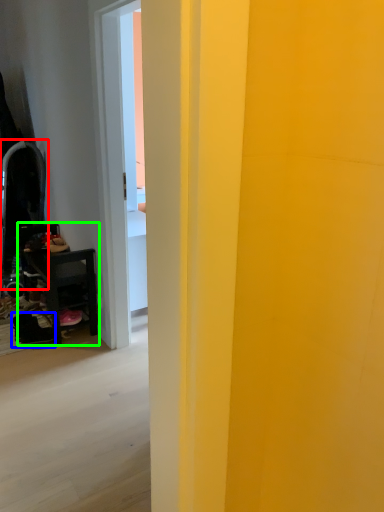
Question: Which object is positioned farthest from swivel chair (highlighted by a red box)? Select from footwear (highlighted by a blue box) and furniture (highlighted by a green box).

Choices:
 (A) footwear
 (B) furniture

Answer: (A)